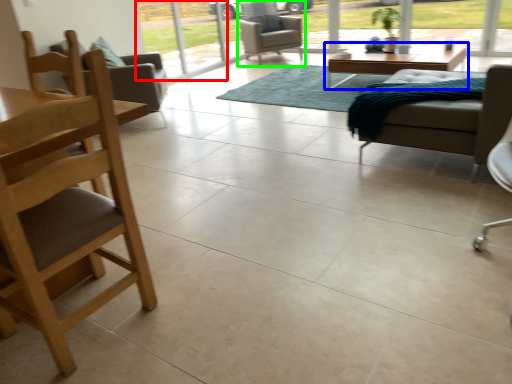
Question: Which object is the closest to the screen door (highlighted by a red box)? Choose among these: coffee table (highlighted by a blue box) or chair (highlighted by a green box).

Choices:
 (A) coffee table
 (B) chair

Answer: (B)